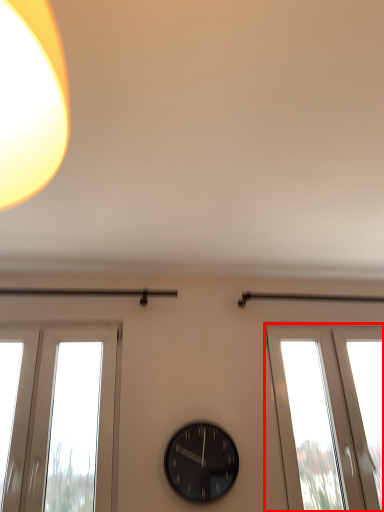
Question: In this image, where is window (annotated by the red box) located relative to wall clock?

Choices:
 (A) right
 (B) left

Answer: (A)